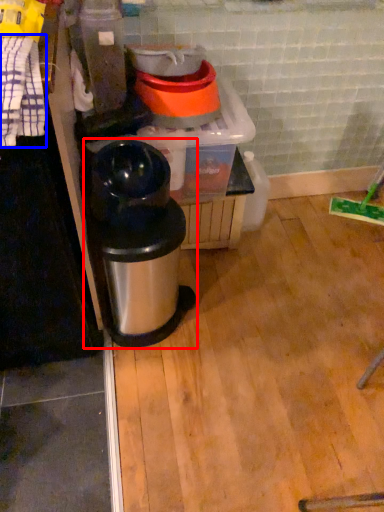
Question: Which object appears closest to the camera in this image, waste container (highlighted by a red box) or laundry (highlighted by a blue box)?

Choices:
 (A) waste container
 (B) laundry

Answer: (B)